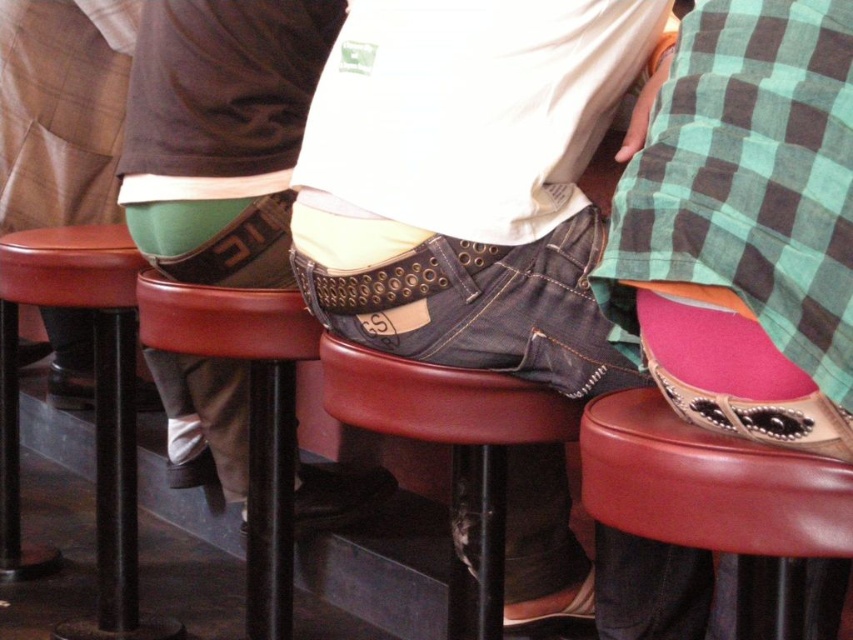
Question: Does jeans at center appear on the right side of leather seat at lower left?

Choices:
 (A) yes
 (B) no

Answer: (A)

Question: Based on their relative distances, which object is nearer to the leather at center?

Choices:
 (A) jeans at center
 (B) smooth leather bar stool at center
 (C) leather seat at lower left

Answer: (B)

Question: Does jeans at center have a lesser width compared to smooth leather bar stool at center?

Choices:
 (A) no
 (B) yes

Answer: (A)

Question: Is leather at center above leather seat at lower left?

Choices:
 (A) yes
 (B) no

Answer: (A)

Question: Which of the following is the closest to the observer?

Choices:
 (A) jeans at center
 (B) leather seat at lower left
 (C) leather at center
 (D) smooth leather bar stool at center

Answer: (C)

Question: Which point is farther to the camera?

Choices:
 (A) leather at center
 (B) jeans at center
 (C) leather seat at lower left
 (D) smooth leather bar stool at center

Answer: (C)